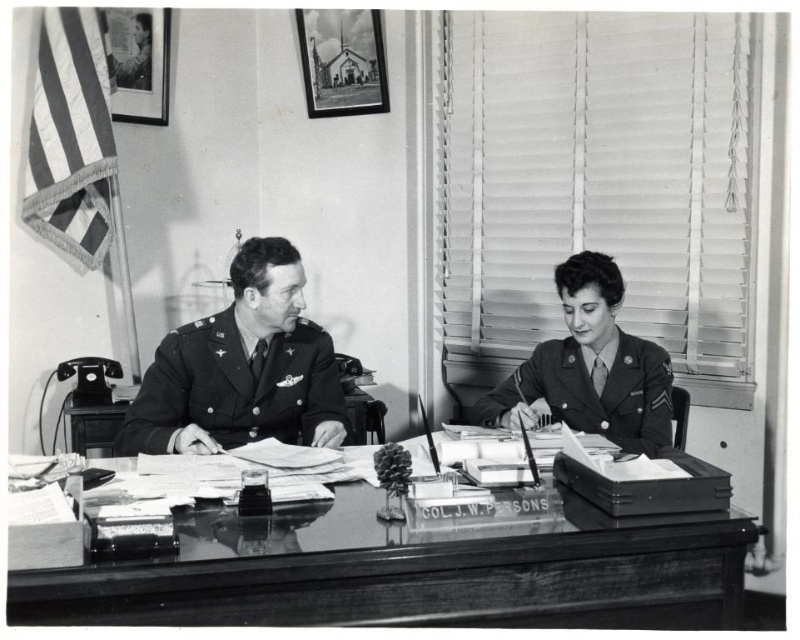
Who is shorter, glossy wood table at center or uniformed woman at center?

glossy wood table at center

Is glossy wood table at center shorter than uniformed woman at center?

Yes, glossy wood table at center is shorter than uniformed woman at center.

Between point (416, 588) and point (610, 394), which one is positioned in front?

Point (416, 588)

Where is `glossy wood table at center`? glossy wood table at center is located at coordinates (416, 568).

Which is below, uniformed officer at center or uniformed woman at center?

uniformed woman at center is lower down.

Is uniformed officer at center above uniformed woman at center?

Yes, uniformed officer at center is above uniformed woman at center.

In the scene shown: Who is more distant from viewer, (202, 449) or (614, 416)?

Positioned behind is point (614, 416).

Where is `uniformed officer at center`? The image size is (800, 640). uniformed officer at center is located at coordinates (241, 369).

Can you confirm if glossy wood table at center is bigger than uniformed officer at center?

Indeed, glossy wood table at center has a larger size compared to uniformed officer at center.

Which is behind, point (62, 592) or point (228, 401)?

Point (228, 401)

Does point (452, 547) come behind point (325, 403)?

No, (452, 547) is in front of (325, 403).

Find the location of a particular element. The width and height of the screenshot is (800, 640). glossy wood table at center is located at coordinates (416, 568).